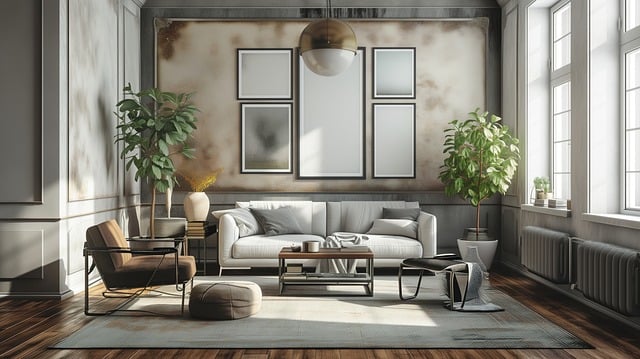
Locate an element on the screen. Image resolution: width=640 pixels, height=359 pixels. tables is located at coordinates (310, 253), (196, 231).